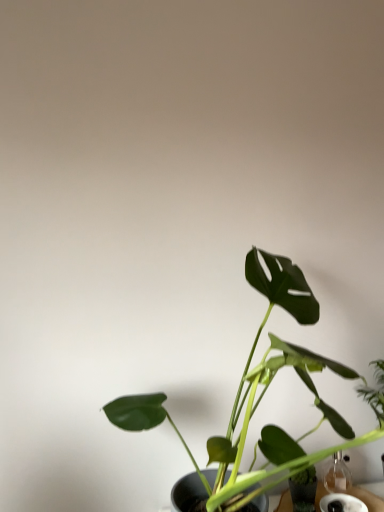
Question: From a real-world perspective, relative to green matte leafy plant at center, is transparent glass vase at lower right vertically above or below?

Choices:
 (A) above
 (B) below

Answer: (B)

Question: Is transparent glass vase at lower right in front of or behind green matte leafy plant at center in the image?

Choices:
 (A) behind
 (B) front

Answer: (A)

Question: From the image's perspective, is transparent glass vase at lower right located above or below green matte leafy plant at center?

Choices:
 (A) below
 (B) above

Answer: (A)

Question: From the image's perspective, relative to transparent glass vase at lower right, is green matte leafy plant at center above or below?

Choices:
 (A) below
 (B) above

Answer: (B)

Question: In the image, is green matte leafy plant at center positioned in front of or behind transparent glass vase at lower right?

Choices:
 (A) behind
 (B) front

Answer: (B)

Question: From a real-world perspective, is green matte leafy plant at center above or below transparent glass vase at lower right?

Choices:
 (A) above
 (B) below

Answer: (A)

Question: Do you think green matte leafy plant at center is within transparent glass vase at lower right, or outside of it?

Choices:
 (A) outside
 (B) inside

Answer: (A)